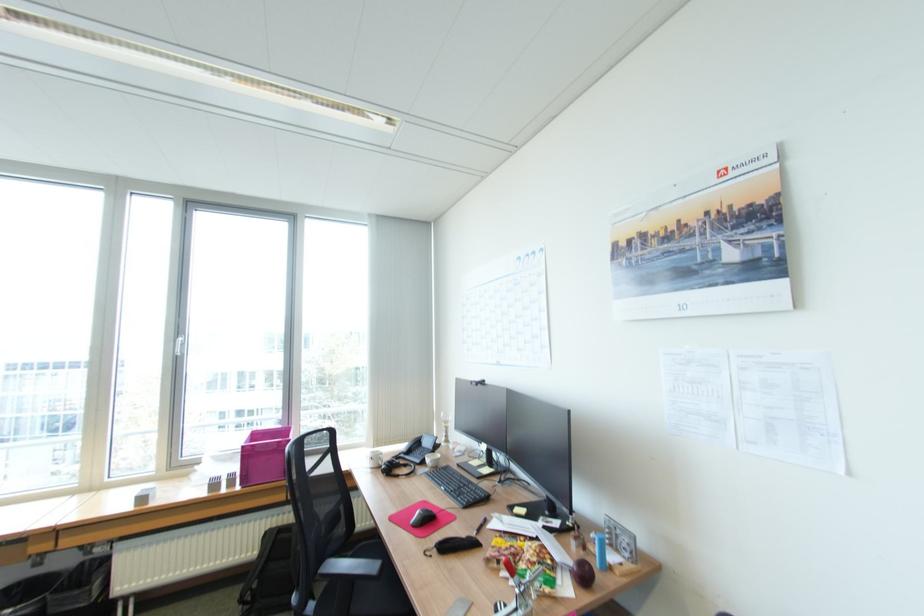
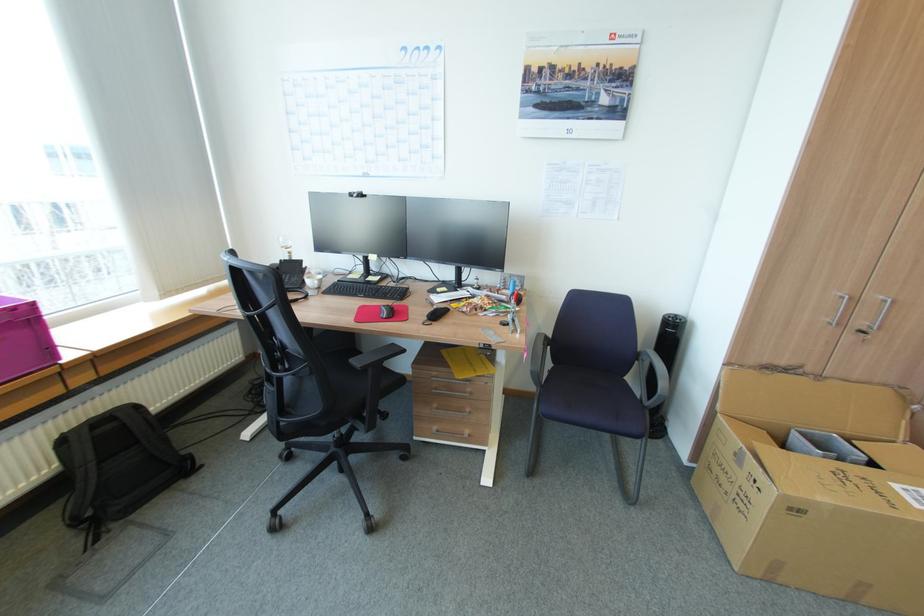
Locate, in the second image, the point that corresponds to (447,414) in the first image.

(286, 238)